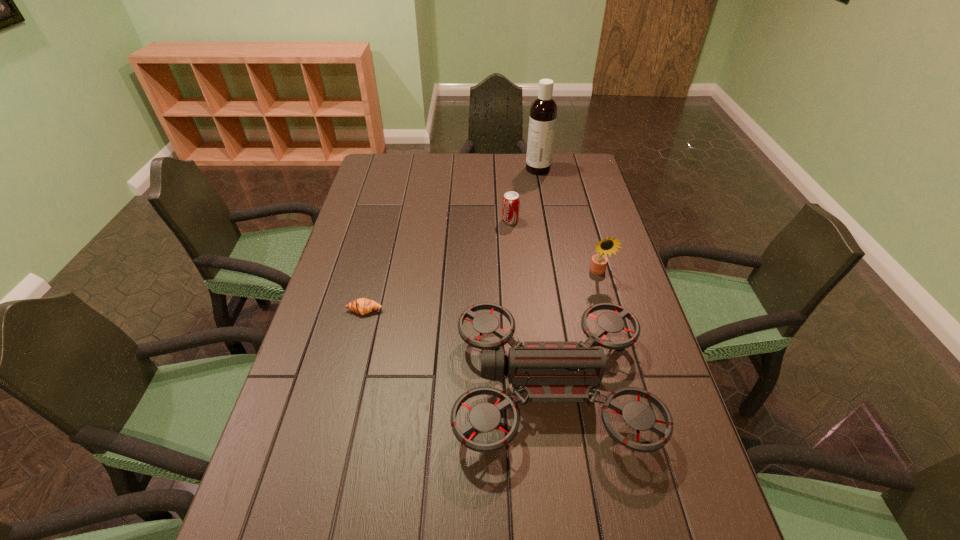
You are a GUI agent. You are given a task and a screenshot of the screen. Output one action in this format:
    pyautogui.click(x=<x>, y=<y>)
    Task: Click on the object that is positioned at the left edge
    The width and height of the screenshot is (960, 540).
    Given the screenshot: What is the action you would take?
    pyautogui.click(x=362, y=306)

Find the location of `sunflower that is at the right edge`. sunflower that is at the right edge is located at coordinates (598, 264).

Identify the location of drone that is at the right edge. (546, 371).

Locate an element on the screen. The height and width of the screenshot is (540, 960). free space at the far edge of the desktop is located at coordinates (423, 157).

The image size is (960, 540). In order to click on free space at the left edge of the desktop in this screenshot , I will do `click(345, 247)`.

The height and width of the screenshot is (540, 960). I want to click on vacant point at the right edge, so click(569, 204).

Locate an element on the screen. This screenshot has height=540, width=960. unoccupied area between the third shortest object and the soda can is located at coordinates (530, 303).

You are a GUI agent. You are given a task and a screenshot of the screen. Output one action in this format:
    pyautogui.click(x=<x>, y=<y>)
    Task: Click on the free space between the fourth tallest object and the drone
    This screenshot has height=540, width=960.
    Given the screenshot: What is the action you would take?
    pyautogui.click(x=530, y=303)

This screenshot has height=540, width=960. Find the location of `free space that is in between the third nearest object and the shortest object`. free space that is in between the third nearest object and the shortest object is located at coordinates (481, 291).

The width and height of the screenshot is (960, 540). What are the coordinates of `free spot between the soda can and the nearest object` in the screenshot? It's located at (530, 303).